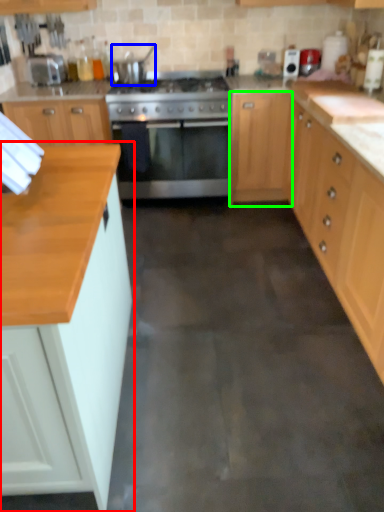
Question: Considering the real-world distances, which object is closest to cabinetry (highlighted by a red box)? appliance (highlighted by a blue box) or cabinetry (highlighted by a green box).

Choices:
 (A) appliance
 (B) cabinetry

Answer: (B)